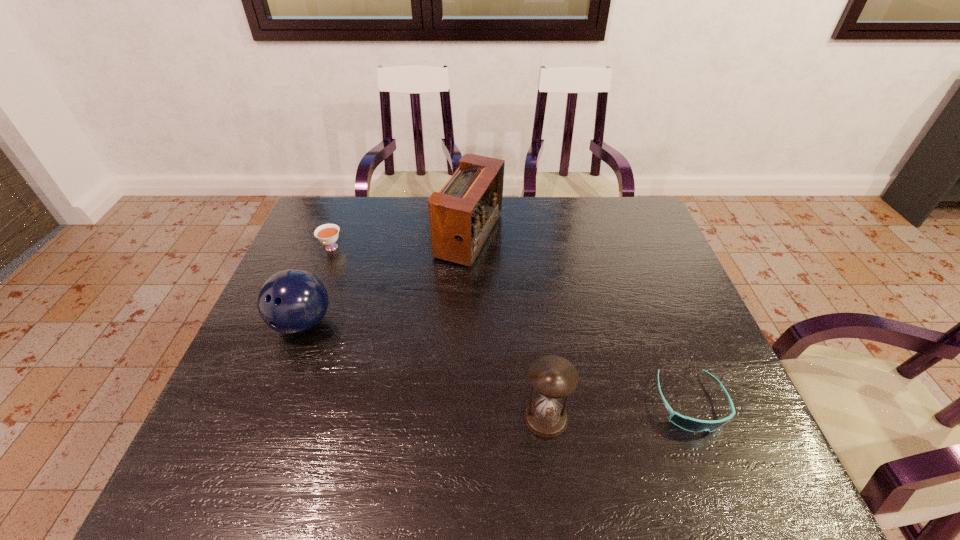
Identify the location of vacant space at the left edge of the desktop. (275, 344).

The width and height of the screenshot is (960, 540). In the image, there is a desktop. Find the location of `vacant space at the far left corner`. vacant space at the far left corner is located at coordinates (353, 217).

Find the location of a particular element. This screenshot has height=540, width=960. empty location between the sunglasses and the radio receiver is located at coordinates (580, 320).

At what (x,y) coordinates should I click in order to perform the action: click on free space between the third farthest object and the rightmost object. Please return your answer as a coordinate pair (x, y). The width and height of the screenshot is (960, 540). Looking at the image, I should click on pos(496,363).

At what (x,y) coordinates should I click in order to perform the action: click on vacant area that lies between the third object from right to left and the second object from right to left. Please return your answer as a coordinate pair (x, y). The image size is (960, 540). Looking at the image, I should click on (508, 327).

At what (x,y) coordinates should I click in order to perform the action: click on vacant region between the rightmost object and the hourglass. Please return your answer as a coordinate pair (x, y). Looking at the image, I should click on coord(618,410).

Identify the location of vacant point located between the third farthest object and the hourglass. (424, 370).

The image size is (960, 540). Find the location of `vacant area that lies between the shortest object and the second shortest object`. vacant area that lies between the shortest object and the second shortest object is located at coordinates click(x=511, y=326).

Where is `vacant area between the third nearest object and the third object from right to left`? vacant area between the third nearest object and the third object from right to left is located at coordinates (386, 280).

Image resolution: width=960 pixels, height=540 pixels. Find the location of `empty location between the third object from right to left and the shortest object`. empty location between the third object from right to left and the shortest object is located at coordinates (580, 320).